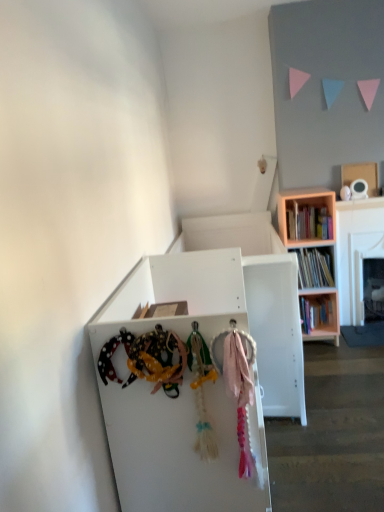
Question: Is wooden bookcase at upper right inside the boundaries of white matte cabinet at center, or outside?

Choices:
 (A) inside
 (B) outside

Answer: (B)

Question: From a real-world perspective, relative to white matte cabinet at center, is wooden bookcase at upper right vertically above or below?

Choices:
 (A) above
 (B) below

Answer: (A)

Question: Which object is positioned closest to the cardboard box at upper right?

Choices:
 (A) wooden bookshelf at right
 (B) white matte cabinet at center
 (C) wooden bookcase at upper right
 (D) pink fabric at center

Answer: (A)

Question: Considering the real-world distances, which object is closest to the cardboard box at upper right?

Choices:
 (A) wooden bookshelf at right
 (B) wooden bookcase at upper right
 (C) pink fabric at center
 (D) white matte cabinet at center

Answer: (A)